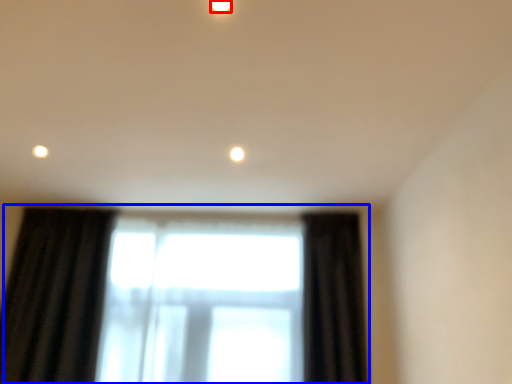
Question: Which object is further to the camera taking this photo, lighting (highlighted by a red box) or window (highlighted by a blue box)?

Choices:
 (A) lighting
 (B) window

Answer: (B)